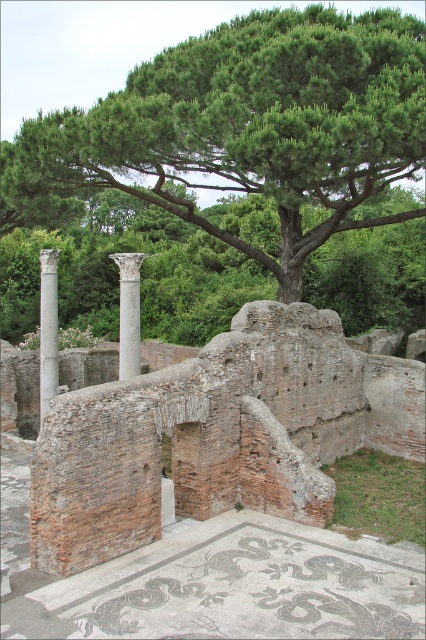
Question: Which of these objects is positioned farthest from the green leafy tree at upper center?

Choices:
 (A) white marble column at left
 (B) brick wall at center
 (C) white marble column at center

Answer: (B)

Question: Can you confirm if green leafy tree at upper center is positioned below white marble column at left?

Choices:
 (A) no
 (B) yes

Answer: (A)

Question: Which object is the closest to the green leafy tree at upper center?

Choices:
 (A) white marble column at left
 (B) brick wall at center
 (C) white marble column at center

Answer: (C)

Question: Can you confirm if white marble column at left is thinner than white marble column at center?

Choices:
 (A) yes
 (B) no

Answer: (B)

Question: Is the position of green leafy tree at upper center more distant than that of white marble column at left?

Choices:
 (A) yes
 (B) no

Answer: (B)

Question: Based on their relative distances, which object is farther from the white marble column at left?

Choices:
 (A) brick wall at center
 (B) green leafy tree at upper center

Answer: (A)